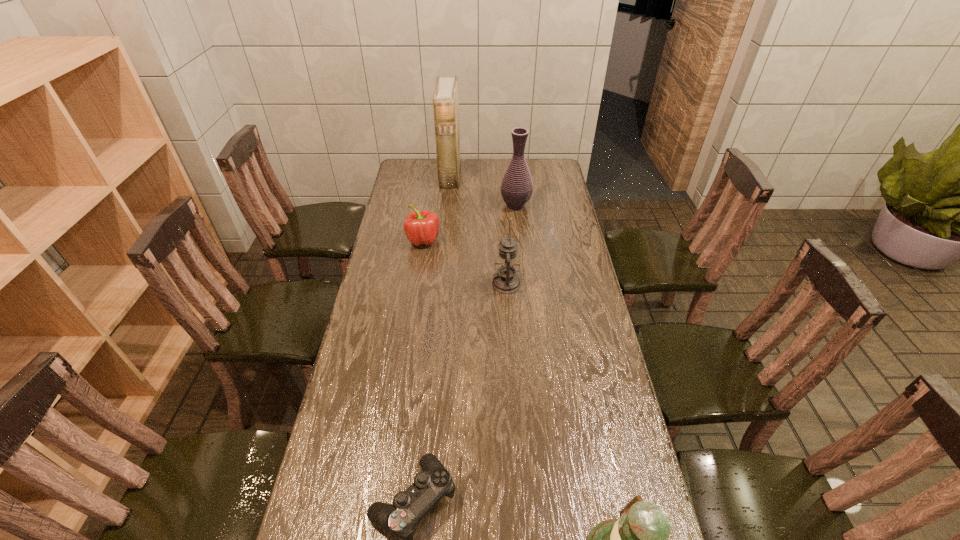
This screenshot has height=540, width=960. I want to click on the farthest object, so click(x=445, y=101).

Locate an element on the screen. phonebook is located at coordinates (445, 101).

Locate an element on the screen. This screenshot has width=960, height=540. the second tallest object is located at coordinates coord(516,187).

The width and height of the screenshot is (960, 540). What are the coordinates of `vase` in the screenshot? It's located at (516, 187).

This screenshot has height=540, width=960. In order to click on the fourth shortest object in this screenshot , I will do `click(506, 281)`.

Identify the location of oil lamp. (506, 281).

Locate an element on the screen. This screenshot has height=540, width=960. the fifth tallest object is located at coordinates (421, 228).

Locate an element on the screen. Image resolution: width=960 pixels, height=540 pixels. pepper is located at coordinates [x=421, y=228].

I want to click on vacant space situated 0.200m on the cover of the phonebook, so click(x=499, y=174).

Locate an element on the screen. The image size is (960, 540). vacant space situated 0.370m on the back of the fifth nearest object is located at coordinates (511, 158).